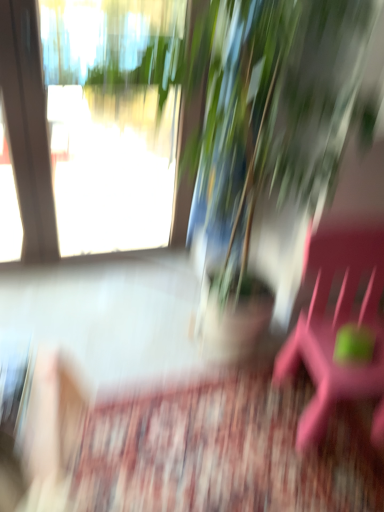
Question: Can you confirm if pink plastic beach chair at right is taller than green leafy plant at upper center?

Choices:
 (A) no
 (B) yes

Answer: (A)

Question: Can you confirm if pink plastic beach chair at right is shorter than green leafy plant at upper center?

Choices:
 (A) yes
 (B) no

Answer: (A)

Question: Can you confirm if pink plastic beach chair at right is wider than green leafy plant at upper center?

Choices:
 (A) yes
 (B) no

Answer: (A)

Question: Does pink plastic beach chair at right come behind green leafy plant at upper center?

Choices:
 (A) yes
 (B) no

Answer: (B)

Question: Considering the relative sizes of pink plastic beach chair at right and green leafy plant at upper center in the image provided, is pink plastic beach chair at right smaller than green leafy plant at upper center?

Choices:
 (A) yes
 (B) no

Answer: (A)

Question: Is pink plastic beach chair at right next to green leafy plant at upper center and touching it?

Choices:
 (A) no
 (B) yes

Answer: (A)

Question: Considering the relative sizes of green leafy plant at upper center and pink plastic beach chair at right in the image provided, is green leafy plant at upper center wider than pink plastic beach chair at right?

Choices:
 (A) yes
 (B) no

Answer: (B)

Question: Can you confirm if green leafy plant at upper center is taller than pink plastic beach chair at right?

Choices:
 (A) yes
 (B) no

Answer: (A)

Question: Is green leafy plant at upper center not within pink plastic beach chair at right?

Choices:
 (A) no
 (B) yes

Answer: (B)

Question: Is green leafy plant at upper center beside pink plastic beach chair at right?

Choices:
 (A) yes
 (B) no

Answer: (B)

Question: Is green leafy plant at upper center further to the viewer compared to pink plastic beach chair at right?

Choices:
 (A) yes
 (B) no

Answer: (A)

Question: Is pink plastic beach chair at right at the back of green leafy plant at upper center?

Choices:
 (A) yes
 (B) no

Answer: (B)

Question: Looking at their shapes, would you say pink plastic beach chair at right is wider or thinner than green leafy plant at upper center?

Choices:
 (A) wide
 (B) thin

Answer: (A)